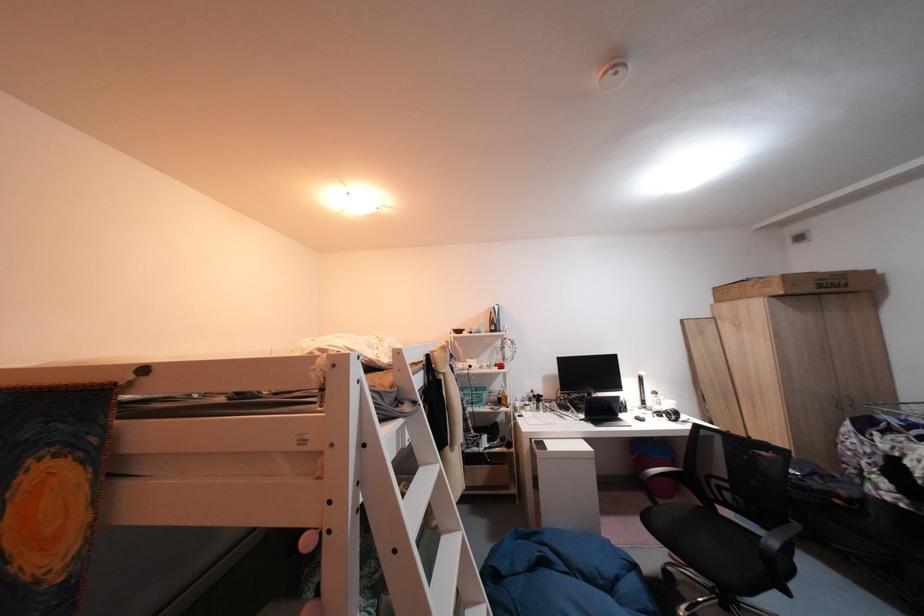
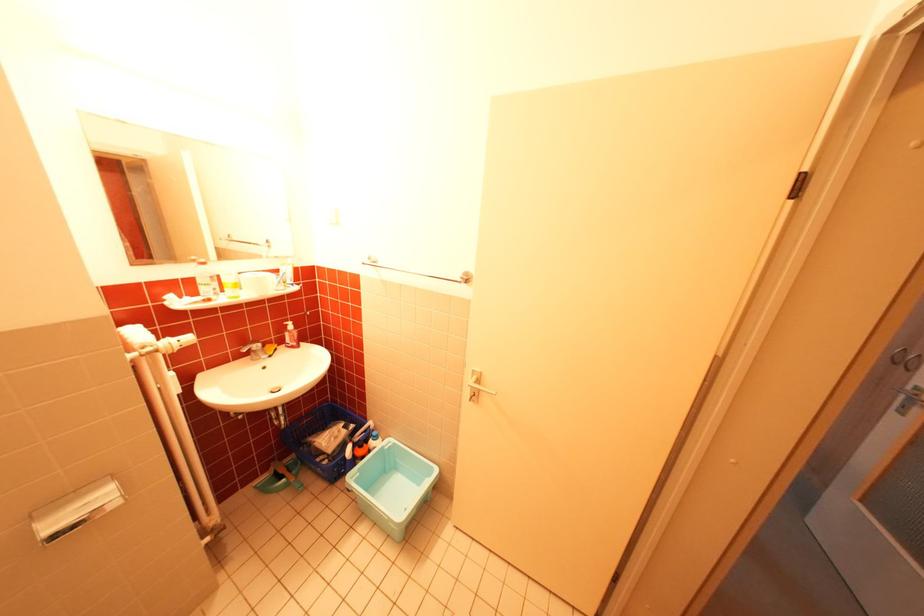
Question: I am providing you with two images of the same scene from different viewpoints. After the viewpoint changes to image2, which objects are now occluded?

Choices:
 (A) black chair armrest
 (B) silver door handle
 (C) green plastic dustpan
 (D) red electrical outlet

Answer: (A)